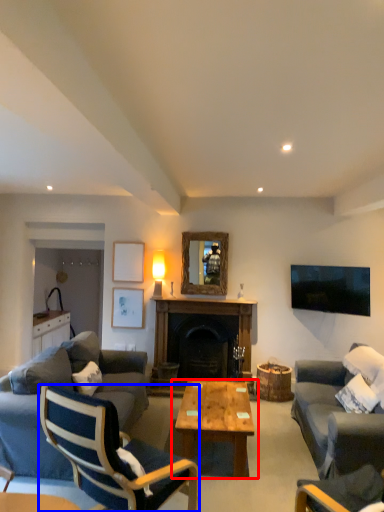
Question: Among these objects, which one is nearest to the camera, coffee table (highlighted by a red box) or chair (highlighted by a blue box)?

Choices:
 (A) coffee table
 (B) chair

Answer: (B)